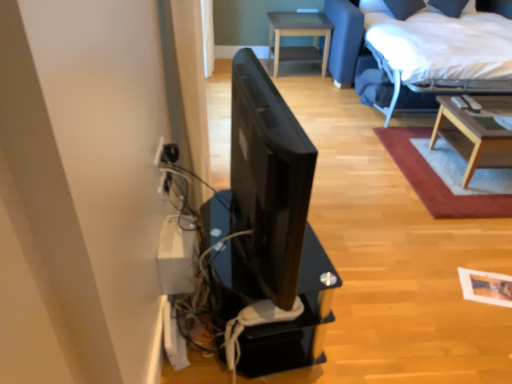
Question: From a real-world perspective, is white fabric bed at upper right beneath wooden coffee table at upper right?

Choices:
 (A) yes
 (B) no

Answer: (B)

Question: From a real-world perspective, is white fabric bed at upper right physically above wooden coffee table at upper right?

Choices:
 (A) yes
 (B) no

Answer: (A)

Question: Is white fabric bed at upper right wider than wooden coffee table at upper right?

Choices:
 (A) no
 (B) yes

Answer: (B)

Question: Is white fabric bed at upper right to the left of wooden coffee table at upper right from the viewer's perspective?

Choices:
 (A) yes
 (B) no

Answer: (B)

Question: Are white fabric bed at upper right and wooden coffee table at upper right located far from each other?

Choices:
 (A) yes
 (B) no

Answer: (B)

Question: Is white fabric bed at upper right positioned before wooden coffee table at upper right?

Choices:
 (A) yes
 (B) no

Answer: (B)

Question: From a real-world perspective, is light brown wooden table at upper center, the first table from the left, positioned over light wood/texture coffee table at upper right, which ranks as the 1th table in front-to-back order, based on gravity?

Choices:
 (A) yes
 (B) no

Answer: (A)

Question: Is light brown wooden table at upper center, the first table from the left, at the left side of light wood/texture coffee table at upper right, which ranks as the 1th table in front-to-back order?

Choices:
 (A) yes
 (B) no

Answer: (A)

Question: Is light brown wooden table at upper center, the 2th table when ordered from front to back, thinner than light wood/texture coffee table at upper right, the 1th table positioned from the bottom?

Choices:
 (A) yes
 (B) no

Answer: (A)

Question: From the image's perspective, is light brown wooden table at upper center, which is the first table from top to bottom, above light wood/texture coffee table at upper right, which is counted as the 2th table, starting from the top?

Choices:
 (A) no
 (B) yes

Answer: (B)

Question: Is light brown wooden table at upper center, placed as the second table when sorted from bottom to top, surrounding light wood/texture coffee table at upper right, which is counted as the 2th table, starting from the top?

Choices:
 (A) yes
 (B) no

Answer: (B)

Question: Is light wood/texture coffee table at upper right, the 1th table positioned from the bottom, at the back of light brown wooden table at upper center, marked as the second table in a right-to-left arrangement?

Choices:
 (A) no
 (B) yes

Answer: (A)

Question: From the image's perspective, is light brown wooden table at upper center, placed as the second table when sorted from bottom to top, below wooden coffee table at upper right?

Choices:
 (A) yes
 (B) no

Answer: (B)